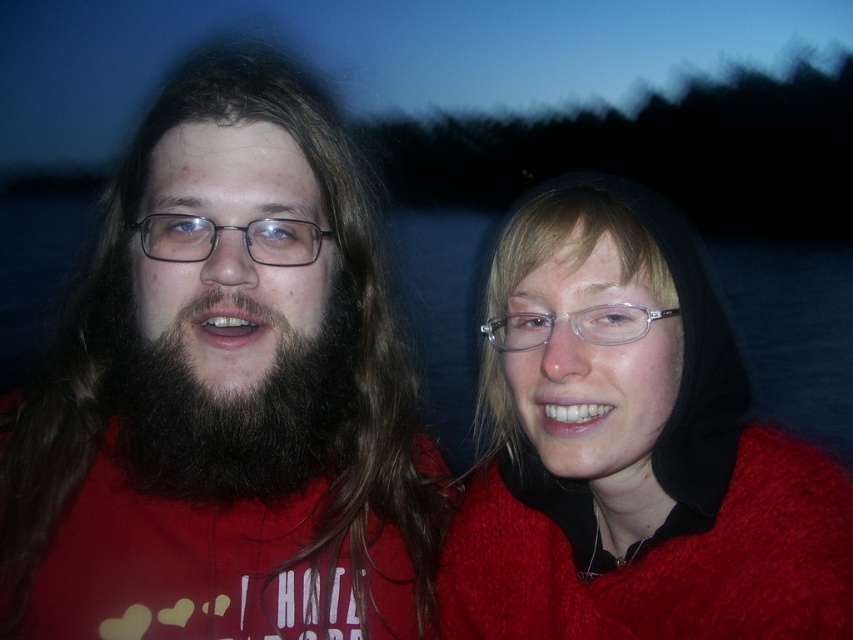
Does matte black beard at left lie behind matte black glasses at left?

No, matte black beard at left is closer to the viewer.

Does point (198, 195) lie in front of point (175, 212)?

Yes.

Who is more forward, (283,582) or (189,214)?

Point (189,214) is in front.

Find the location of a particular element. Image resolution: width=853 pixels, height=640 pixels. matte black beard at left is located at coordinates (224, 401).

Find the location of `matte black beard at left`. matte black beard at left is located at coordinates (224, 401).

Is point (49, 611) farther from camera compared to point (762, 516)?

Yes, point (49, 611) is farther from viewer.

Identify the location of matte black beard at left. coord(224,401).

Is point (485, 506) behind point (248, 230)?

Yes.

Is matte red sweater at right above matte black glasses at left?

Actually, matte red sweater at right is below matte black glasses at left.

Is point (660, 401) positioned after point (288, 252)?

No, (660, 401) is in front of (288, 252).

You are a GUI agent. You are given a task and a screenshot of the screen. Output one action in this format:
    pyautogui.click(x=<x>, y=<y>)
    Task: Click on the matte red sweater at right
    
    Given the screenshot: What is the action you would take?
    pyautogui.click(x=631, y=449)